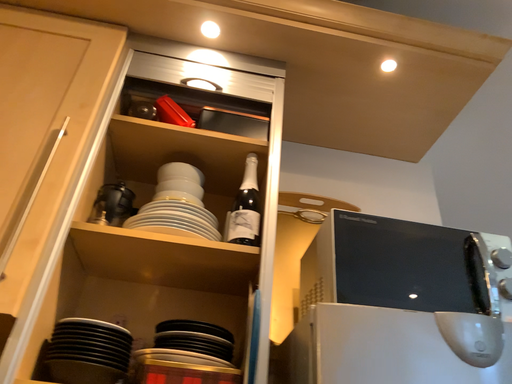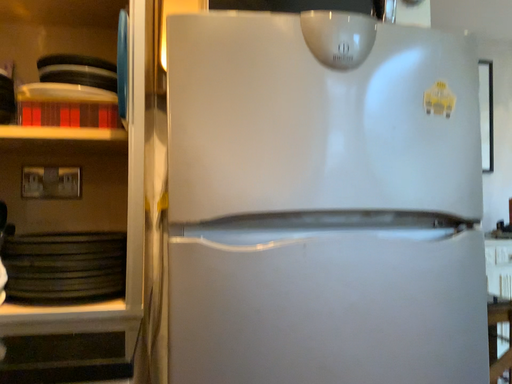
Question: Which way did the camera rotate in the video?

Choices:
 (A) rotated upward
 (B) rotated downward

Answer: (B)